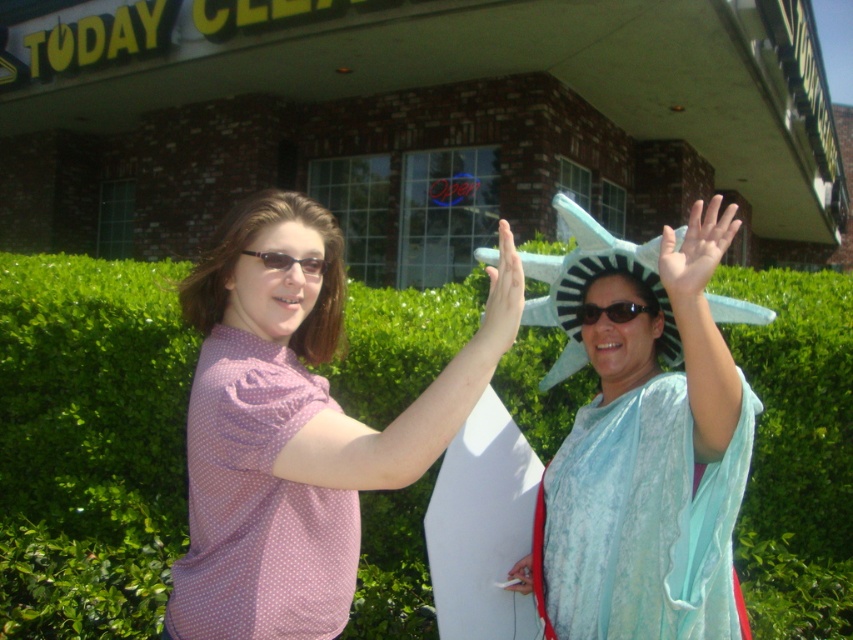
You are standing in front of the building with the sign and want to take a photo of the green leafy hedge at center and the pink polka dot shirt at center. If you want the hedge to appear to the left of the shirt in the photo, should you position yourself to the left or right of the two objects?

You should position yourself to the right of the green leafy hedge at center and pink polka dot shirt at center. Since the green leafy hedge at center is already to the left of pink polka dot shirt at center, positioning yourself to the right would maintain their left to right orientation in the photo.

You are trying to determine if the matte blue statue at center can be placed in a space that is currently occupied by the matte black sunglasses at center. Based on their widths, will the statue fit without overlapping?

The matte blue statue at center might be wider than matte black sunglasses at center, so there is a possibility that it may not fit without overlapping. It depends on the exact dimensions, but based on the given information, there is a risk of overlap.

You are trying to decide which object to pick up first. Since the matte blue statue at center is bigger than the matte black sunglasses at center, which one should you grab first if you want to pick up the larger object?

The matte blue statue at center is larger than the matte black sunglasses at center, so you should grab the matte blue statue at center first if you want to pick up the larger object.